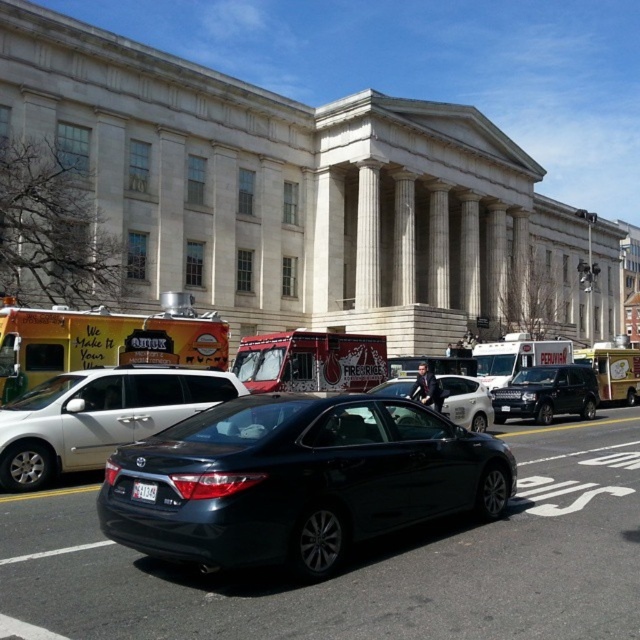
Which is above, glossy black sedan at center or satin black sedan at center?

Positioned higher is satin black sedan at center.

Between glossy black sedan at center and satin black sedan at center, which one appears on the left side from the viewer's perspective?

satin black sedan at center is more to the left.

Does point (196, 465) lie in front of point (204, 392)?

Yes, it is in front of point (204, 392).

Identify the location of glossy black sedan at center. The height and width of the screenshot is (640, 640). (298, 481).

Which of these two, white cardboard food truck at right or shiny black sedan at center, stands taller?

white cardboard food truck at right

Which is behind, point (500, 349) or point (449, 404)?

The point (500, 349) is more distant.

Does point (564, 342) lie in front of point (461, 420)?

No, it is behind (461, 420).

Find the location of a particular element. white cardboard food truck at right is located at coordinates (516, 356).

Which of these two, shiny black suv at center or shiny black sedan at center, stands taller?

shiny black suv at center is taller.

This screenshot has width=640, height=640. What do you see at coordinates (547, 394) in the screenshot? I see `shiny black suv at center` at bounding box center [547, 394].

Measure the distance between shiny black suv at center and camera.

A distance of 19.85 meters exists between shiny black suv at center and camera.

The height and width of the screenshot is (640, 640). What are the coordinates of `shiny black suv at center` in the screenshot? It's located at (547, 394).